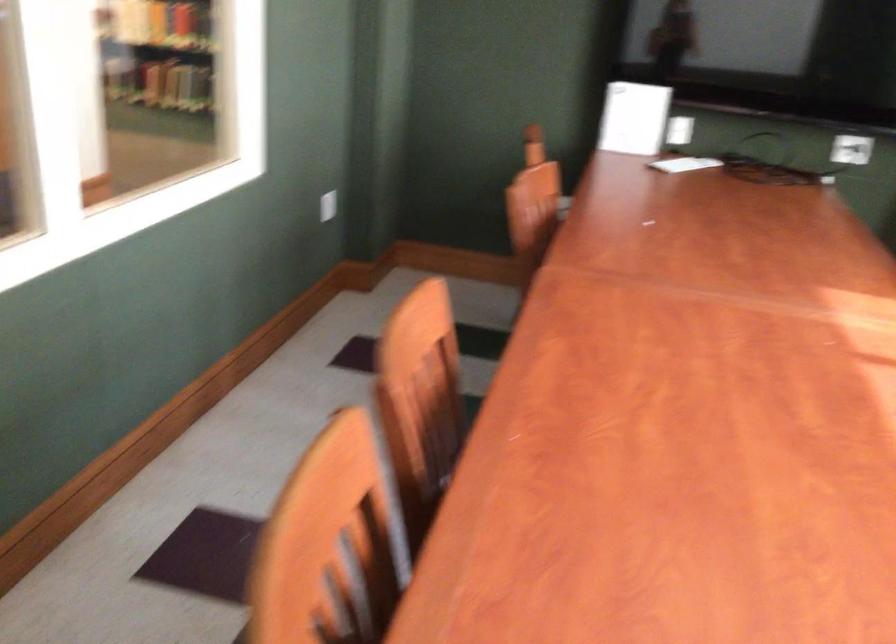
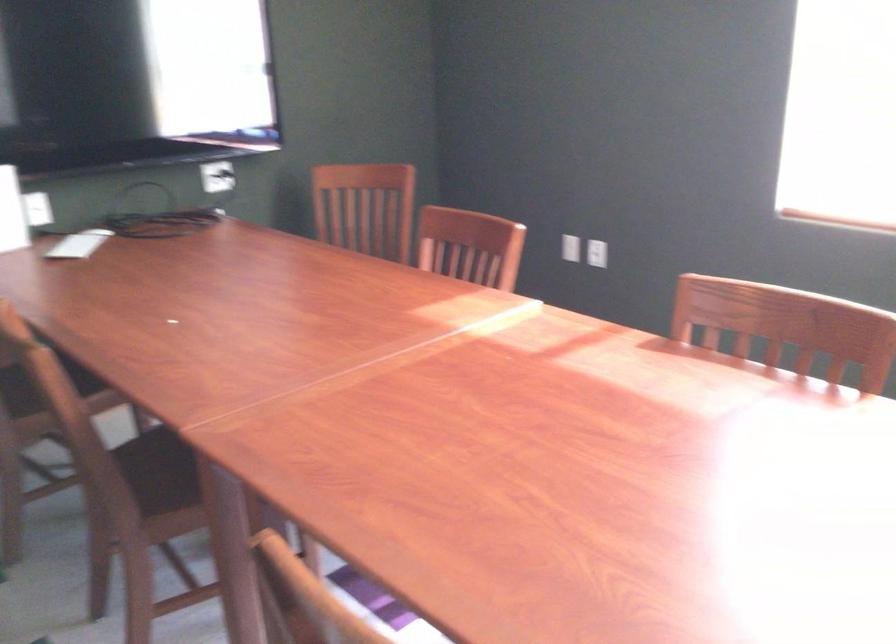
Question: Based on the continuous images, in which direction is the camera rotating? Reply with the corresponding letter.

Choices:
 (A) Left
 (B) Right
 (C) Up
 (D) Down

Answer: (B)